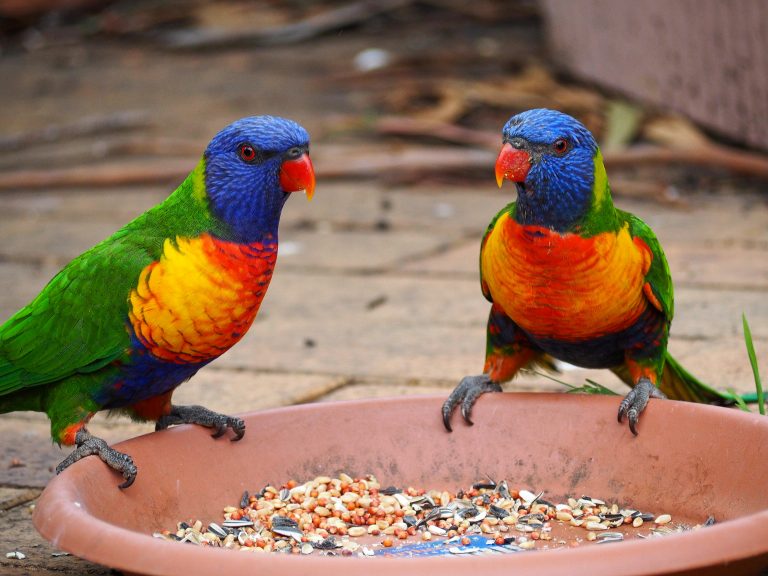
Locate an element on the screen. The image size is (768, 576). brick floor is located at coordinates (35, 458), (269, 367), (379, 310), (389, 229), (742, 211).